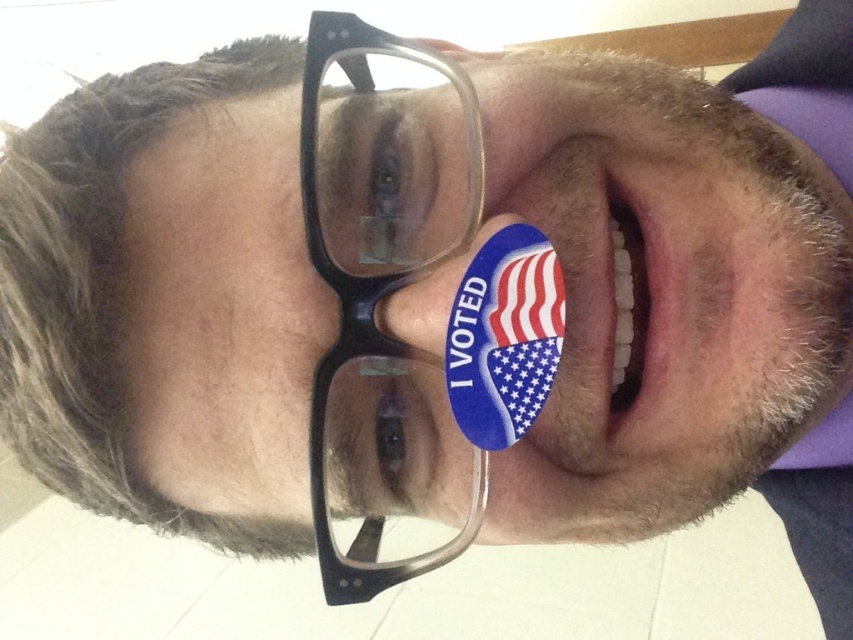
Question: Based on their relative distances, which object is nearer to the blue matte sticker at lower center?

Choices:
 (A) black plastic glasses at center
 (B) white glossy teeth at center

Answer: (B)

Question: Estimate the real-world distances between objects in this image. Which object is farther from the black plastic glasses at center?

Choices:
 (A) white glossy teeth at center
 (B) blue matte sticker at lower center

Answer: (A)

Question: Is black plastic glasses at center bigger than white glossy teeth at center?

Choices:
 (A) no
 (B) yes

Answer: (B)

Question: Can you confirm if black plastic glasses at center is positioned to the right of white glossy teeth at center?

Choices:
 (A) no
 (B) yes

Answer: (A)

Question: Among these objects, which one is farthest from the camera?

Choices:
 (A) white glossy teeth at center
 (B) black plastic glasses at center

Answer: (A)

Question: Where is black plastic glasses at center located in relation to blue matte sticker at lower center in the image?

Choices:
 (A) left
 (B) right

Answer: (A)